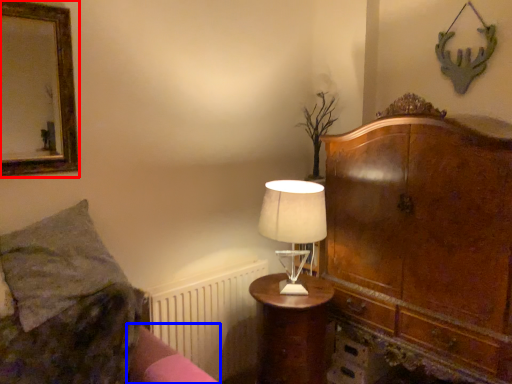
Question: Among these objects, which one is nearest to the camera, picture frame (highlighted by a red box) or bed frame (highlighted by a blue box)?

Choices:
 (A) picture frame
 (B) bed frame

Answer: (B)